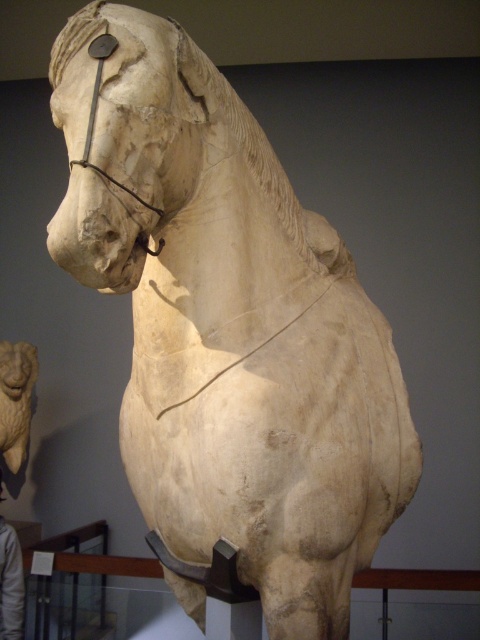
Question: Does white marble lion at upper left have a lesser width compared to light brown leather jacket at lower left?

Choices:
 (A) yes
 (B) no

Answer: (A)

Question: Is white marble lion at upper left positioned behind light brown leather jacket at lower left?

Choices:
 (A) yes
 (B) no

Answer: (A)

Question: Observing the image, what is the correct spatial positioning of white marble lion at upper left in reference to light brown leather jacket at lower left?

Choices:
 (A) below
 (B) above

Answer: (B)

Question: Which object appears closest to the camera in this image?

Choices:
 (A) light brown leather jacket at lower left
 (B) white marble lion at upper left

Answer: (A)

Question: Which point is farther to the camera?

Choices:
 (A) (24, 384)
 (B) (12, 637)

Answer: (A)

Question: Which point is farther to the camera?

Choices:
 (A) white marble lion at upper left
 (B) light brown leather jacket at lower left

Answer: (A)